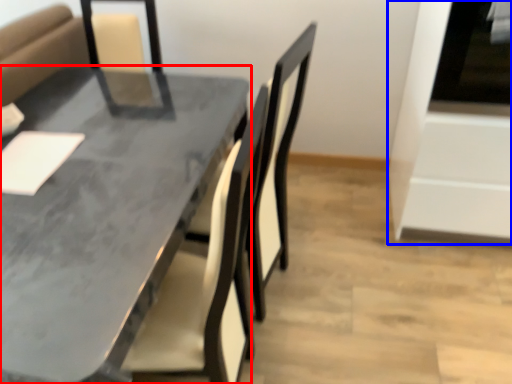
Question: Which object appears farthest to the camera in this image, table (highlighted by a red box) or oven (highlighted by a blue box)?

Choices:
 (A) table
 (B) oven

Answer: (B)